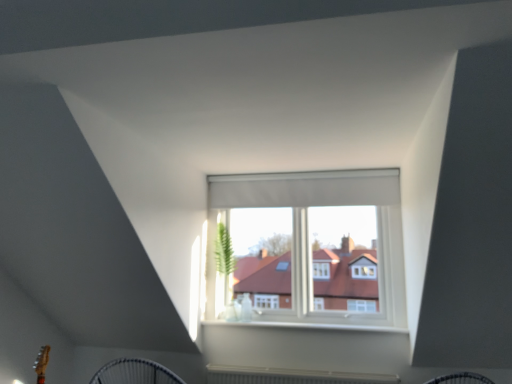
Where is `green matte plant at center`? green matte plant at center is located at coordinates (224, 256).

What do you see at coordinates (224, 256) in the screenshot? Image resolution: width=512 pixels, height=384 pixels. I see `green matte plant at center` at bounding box center [224, 256].

Measure the distance between point (x=232, y=249) and camera.

3.84 meters.

Locate an element on the screen. The width and height of the screenshot is (512, 384). green matte plant at center is located at coordinates (224, 256).